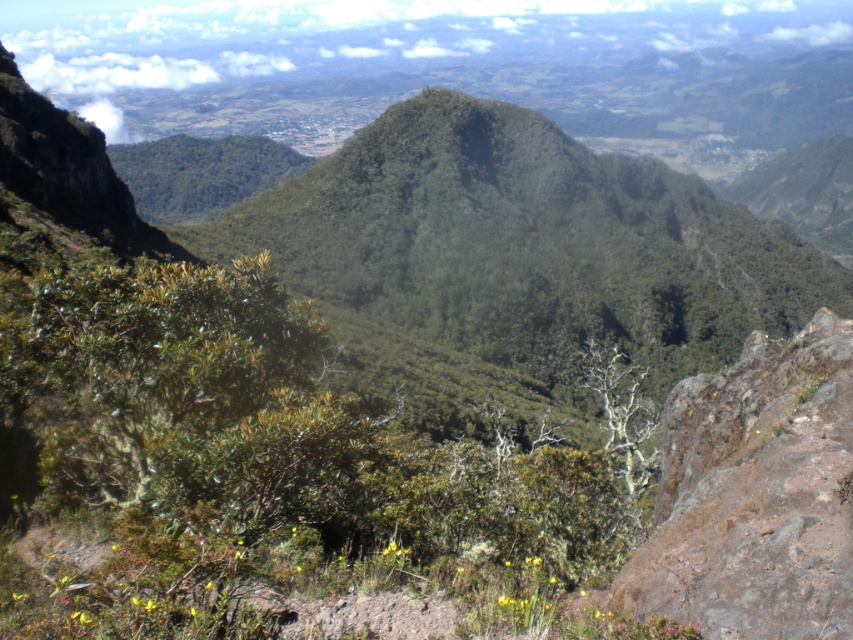
You are a hiker who wants to take a photo of both the green leafy shrub at center and the brown rough rock at right. Since you can only focus on one object at a time, which one should you focus on to ensure the other is in the background?

You should focus on the green leafy shrub at center because it is in front of the brown rough rock at right, so the rock will naturally be in the background when the shrub is in focus.

You are a hiker planning to cross the rugged terrain in the foreground. You notice a green leafy shrub at center and a brown rough rock at right. Which of these two objects would you encounter first as you move forward?

The green leafy shrub at center is larger in size than the brown rough rock at right, so you would encounter the green leafy shrub at center first since it is closer to your current position.

You are standing at the highest point of the mountain peak in the midground. Looking down, you see a point marked at coordinates (254, 467). What object is located at that point?

The point at coordinates (254, 467) marks a green leafy shrub at center.